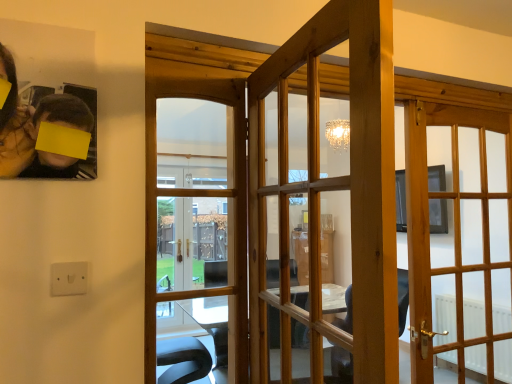
Question: In terms of height, does wooden glass door at center, which is the 2th door in left-to-right order, look taller or shorter compared to wooden glass door at center, arranged as the 1th door when viewed from the left?

Choices:
 (A) short
 (B) tall

Answer: (A)

Question: From a real-world perspective, is wooden glass door at center, acting as the second door starting from the right, positioned above or below wooden glass door at center, arranged as the 1th door when viewed from the left?

Choices:
 (A) above
 (B) below

Answer: (B)

Question: Which object is the closest to the green matte plant at upper left?

Choices:
 (A) wooden glass door at center, which is the 2th door in left-to-right order
 (B) white plastic electric outlet at lower left
 (C) light wood door at right, which is the third door in left-to-right order
 (D) wooden glass door at center, the 2th door from the front

Answer: (B)

Question: Which of these objects is positioned closest to the green matte plant at upper left?

Choices:
 (A) wooden glass door at center, which appears as the 3th door when viewed from the right
 (B) wooden glass door at center, acting as the second door starting from the right
 (C) white plastic electric outlet at lower left
 (D) light wood door at right, placed as the 1th door when sorted from back to front

Answer: (C)